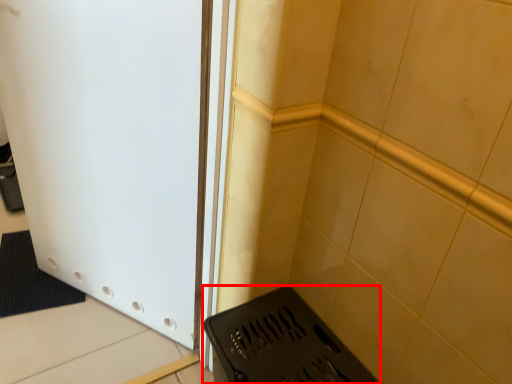
Question: Where is appliance (annotated by the red box) located in relation to door in the image?

Choices:
 (A) right
 (B) left

Answer: (A)